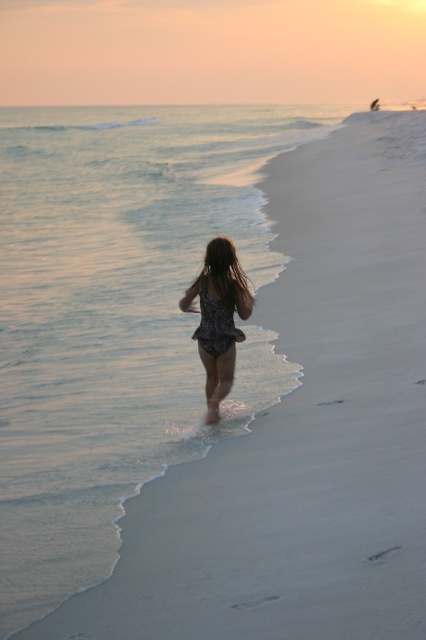
Question: Which object is closer to the camera taking this photo?

Choices:
 (A) clear water at lower left
 (B) brown silky hair at center

Answer: (A)

Question: Which of the following is the closest to the observer?

Choices:
 (A) (219, 237)
 (B) (19, 346)

Answer: (A)

Question: Can you confirm if sparkly sequin dress at center is positioned to the right of brown silky hair at center?

Choices:
 (A) no
 (B) yes

Answer: (A)

Question: Is clear water at lower left below sparkly sequin dress at center?

Choices:
 (A) no
 (B) yes

Answer: (A)

Question: Is clear water at lower left to the right of sparkly sequin dress at center from the viewer's perspective?

Choices:
 (A) no
 (B) yes

Answer: (A)

Question: Among these points, which one is nearest to the camera?

Choices:
 (A) (206, 256)
 (B) (155, 392)

Answer: (A)